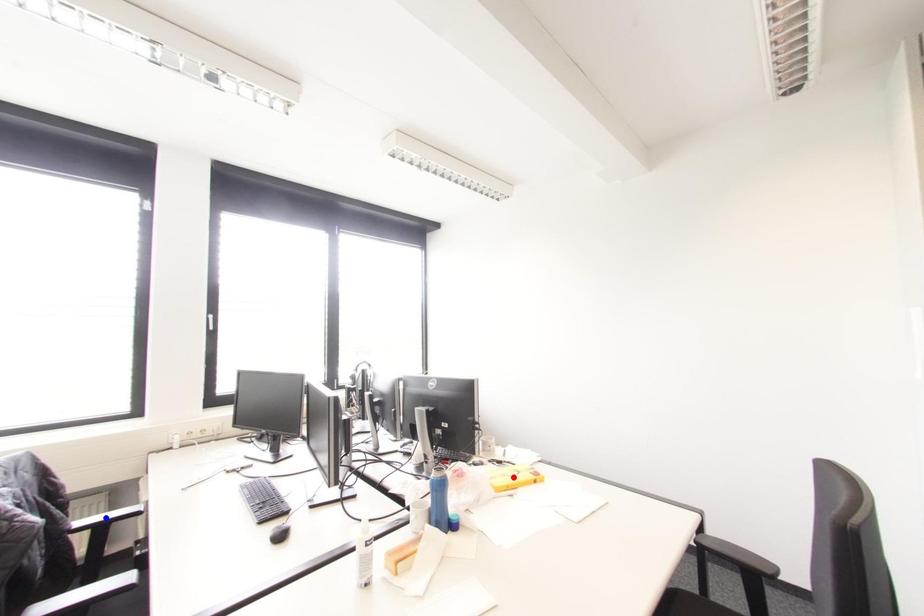
Question: Two points are marked on the image. Which point is closer to the camera?

Choices:
 (A) Blue point is closer.
 (B) Red point is closer.

Answer: (A)